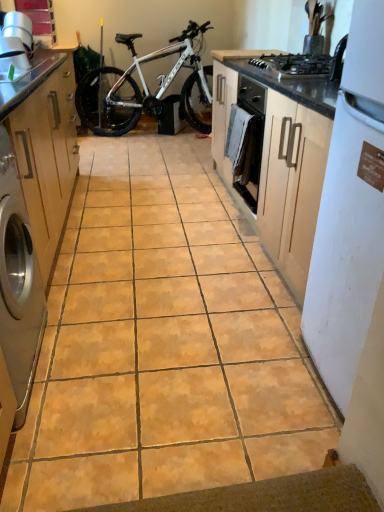
In order to click on free space to the left of white matte refrigerator at right in this screenshot , I will do `click(255, 377)`.